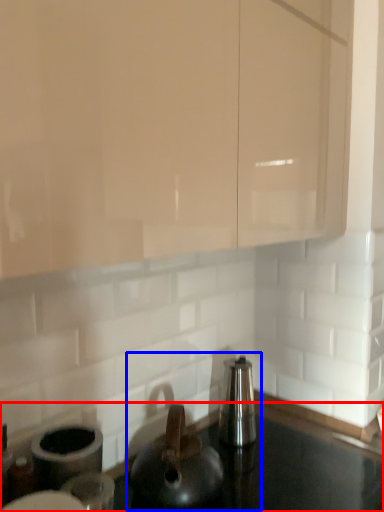
Question: Which point is closer to the camera, countertop (highlighted by a red box) or sink (highlighted by a blue box)?

Choices:
 (A) countertop
 (B) sink

Answer: (A)